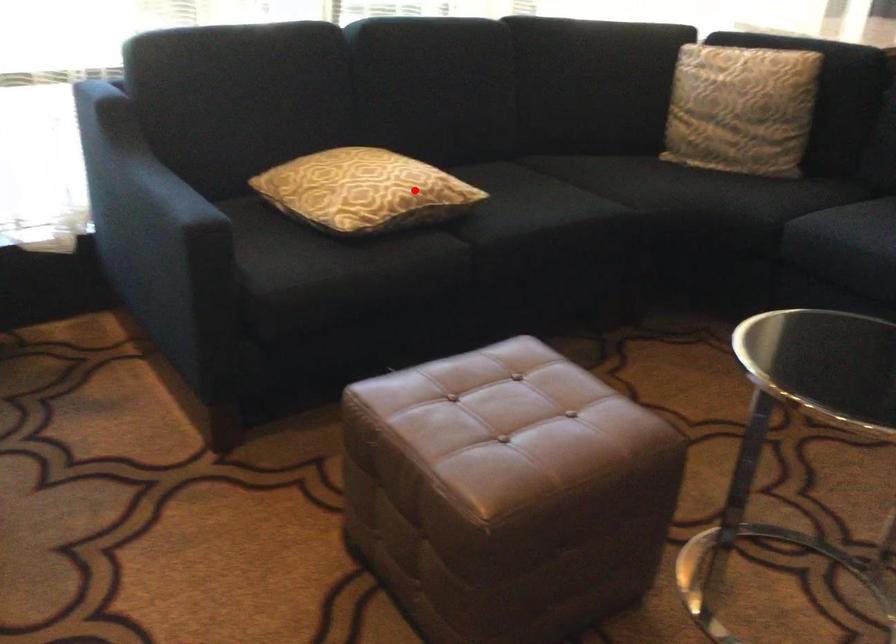
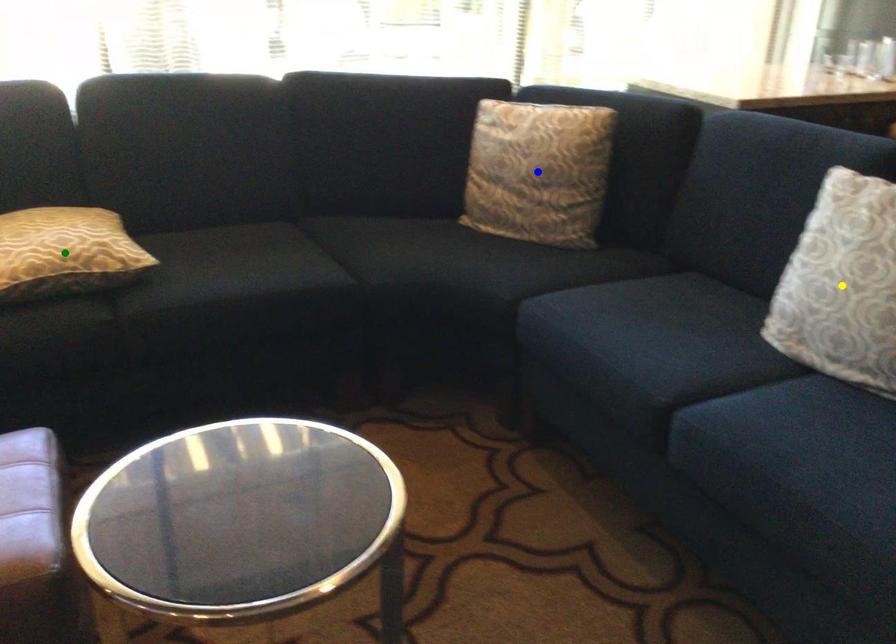
Question: I am providing you with two images of the same scene from different viewpoints. A red point is marked on the first image. You are given multiple points on the second image. In image 2, which mark is for the same physical point as the one in image 1?

Choices:
 (A) green point
 (B) yellow point
 (C) blue point

Answer: (A)